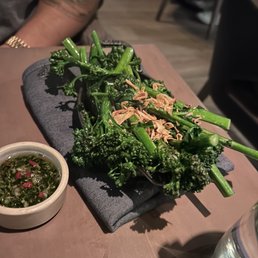
This screenshot has height=258, width=258. I want to click on back of chair, so click(236, 58).